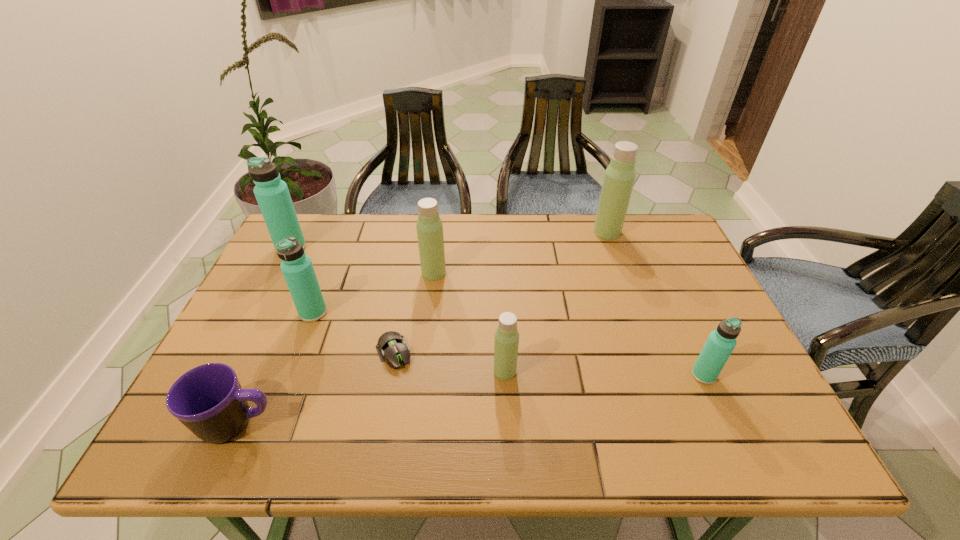
Identify the location of free space at the near edge. (698, 441).

Where is `vacant space at the left edge of the desktop`? vacant space at the left edge of the desktop is located at coordinates click(236, 369).

In the image, there is a desktop. Find the location of `vacant space at the right edge`. vacant space at the right edge is located at coordinates [x=720, y=415].

In the image, there is a desktop. Where is `vacant space at the near left corner`? This screenshot has height=540, width=960. vacant space at the near left corner is located at coordinates (253, 433).

Locate an element on the screen. vacant space at the far right corner of the desktop is located at coordinates coord(645,232).

Image resolution: width=960 pixels, height=540 pixels. Identify the location of vacant point located between the second light thermos bottle from right to left and the second farthest aqua thermos bottle. (409, 342).

Locate an element on the screen. vacant area between the seventh tallest object and the second object from right to left is located at coordinates (422, 328).

Where is `empty space that is in between the biggest aqua thermos bottle and the rightmost aqua thermos bottle`? The image size is (960, 540). empty space that is in between the biggest aqua thermos bottle and the rightmost aqua thermos bottle is located at coordinates (497, 312).

Identify the location of free space between the smallest aqua thermos bottle and the farthest aqua thermos bottle. (497, 312).

Where is `vacant region between the nearest light thermos bottle and the computer mouse`? The height and width of the screenshot is (540, 960). vacant region between the nearest light thermos bottle and the computer mouse is located at coordinates (449, 362).